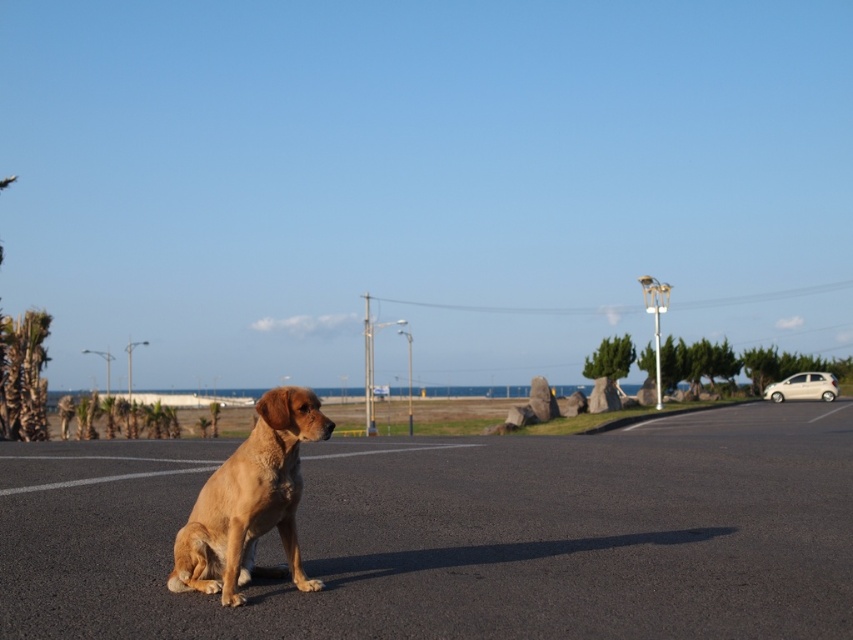
How distant is smooth asphalt parking lot at center from golden fur dog at center?

smooth asphalt parking lot at center and golden fur dog at center are 12.70 feet apart from each other.

The width and height of the screenshot is (853, 640). What do you see at coordinates (463, 536) in the screenshot?
I see `smooth asphalt parking lot at center` at bounding box center [463, 536].

Is point (573, 612) less distant than point (328, 432)?

No.

Locate an element on the screen. smooth asphalt parking lot at center is located at coordinates (463, 536).

From the picture: Does green leafy palm tree at left appear under beige glossy hatchback at right?

No, green leafy palm tree at left is not below beige glossy hatchback at right.

Locate an element on the screen. This screenshot has width=853, height=640. green leafy palm tree at left is located at coordinates (22, 376).

The height and width of the screenshot is (640, 853). In order to click on green leafy palm tree at left in this screenshot , I will do (22, 376).

Between golden fur dog at center and green leafy palm tree at left, which one has less height?

golden fur dog at center

What do you see at coordinates (250, 502) in the screenshot?
I see `golden fur dog at center` at bounding box center [250, 502].

Between point (177, 536) and point (33, 321), which one is positioned behind?

The point (33, 321) is more distant.

The height and width of the screenshot is (640, 853). What are the coordinates of `golden fur dog at center` in the screenshot? It's located at (250, 502).